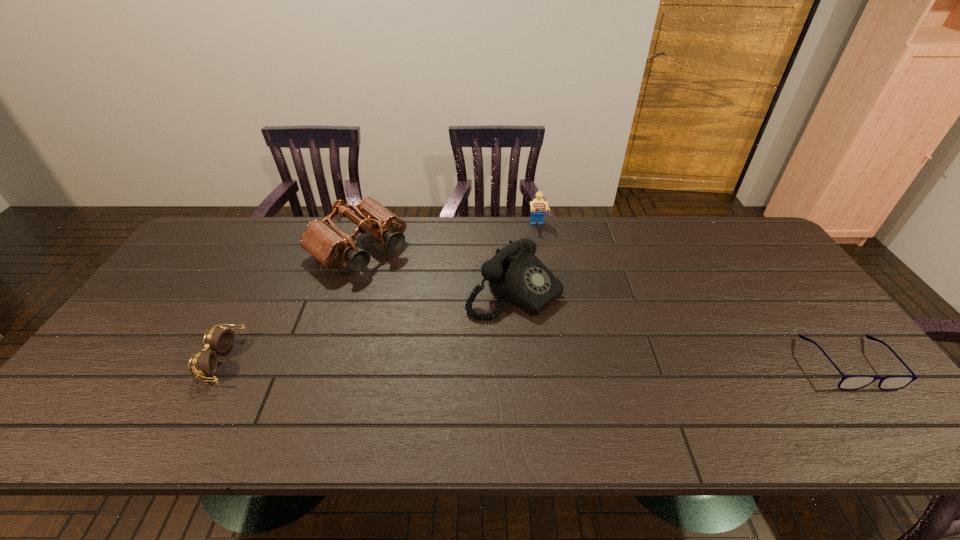
Locate an element on the screen. free space that is in between the rightmost object and the second shortest object is located at coordinates (535, 361).

You are a GUI agent. You are given a task and a screenshot of the screen. Output one action in this format:
    pyautogui.click(x=<x>, y=<y>)
    Task: Click on the vacant space in between the spectacles and the second object from left to right
    This screenshot has width=960, height=540.
    Given the screenshot: What is the action you would take?
    pyautogui.click(x=604, y=306)

In order to click on free space between the goggles and the shortest object in this screenshot , I will do `click(535, 361)`.

Where is `vacant point located between the leftmost object and the telephone`? This screenshot has height=540, width=960. vacant point located between the leftmost object and the telephone is located at coordinates (368, 325).

I want to click on blank region between the goggles and the Lego, so click(x=379, y=293).

Locate an element on the screen. The width and height of the screenshot is (960, 540). unoccupied area between the rightmost object and the telephone is located at coordinates click(x=682, y=327).

This screenshot has width=960, height=540. Identify the location of free spot between the Lego and the binoculars. (448, 237).

This screenshot has width=960, height=540. I want to click on empty location between the shortest object and the fourth tallest object, so click(535, 361).

Find the location of a particular element. The image size is (960, 540). vacant area that lies between the second object from left to right and the shortest object is located at coordinates (604, 306).

The height and width of the screenshot is (540, 960). I want to click on object that ranks as the fourth closest to the second object from left to right, so click(849, 382).